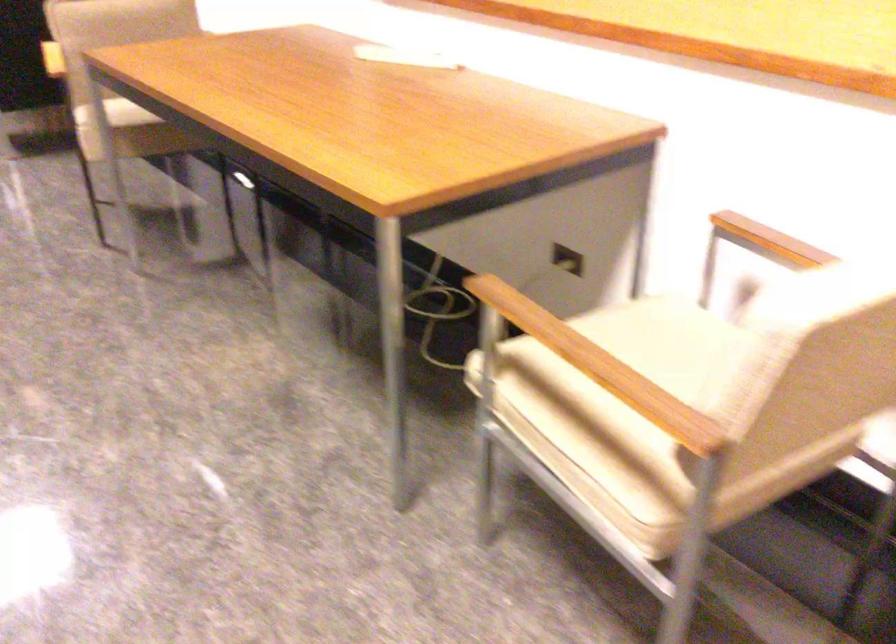
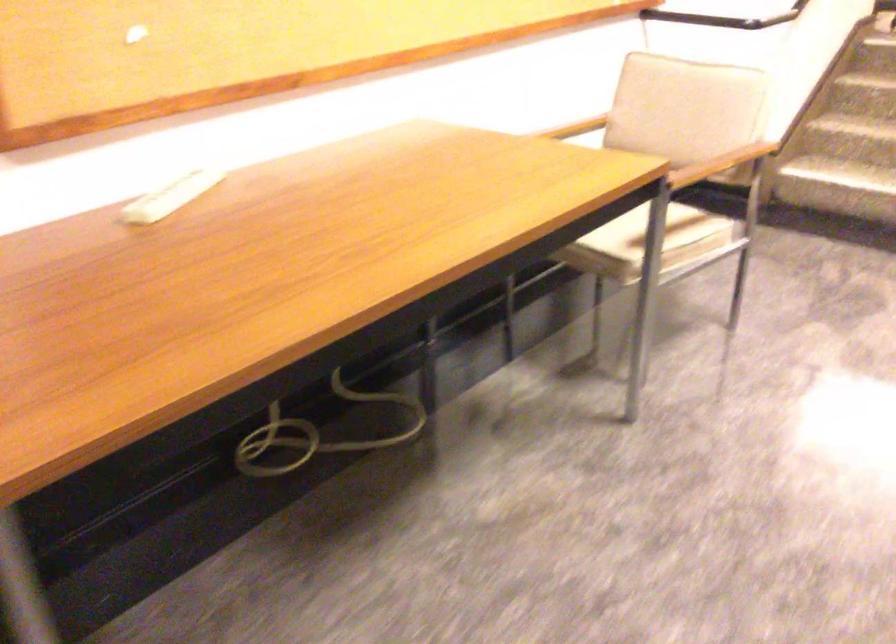
The point at (452, 317) is marked in the first image. Where is the corresponding point in the second image?

(317, 433)